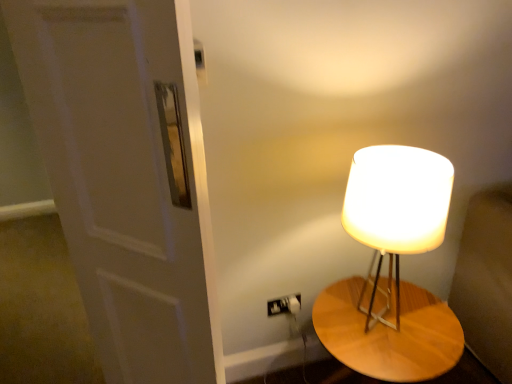
Question: From the image's perspective, is white matte door at left located above or below wooden table at right?

Choices:
 (A) below
 (B) above

Answer: (B)

Question: Is point (116, 360) closer or farther from the camera than point (412, 370)?

Choices:
 (A) closer
 (B) farther

Answer: (B)

Question: Estimate the real-world distances between objects in this image. Which object is farther from the wooden table at right?

Choices:
 (A) white matte door at left
 (B) matte white lampshade at right

Answer: (A)

Question: Considering the real-world distances, which object is farthest from the white matte door at left?

Choices:
 (A) matte white lampshade at right
 (B) wooden table at right

Answer: (B)